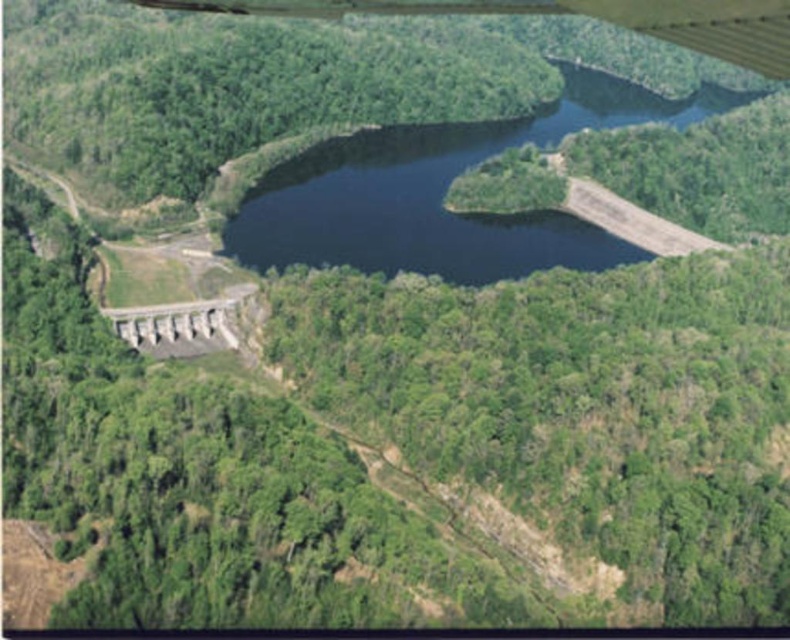
Based on the scene, what does the point at coordinates (442, 193) represent?

The point at coordinates (442, 193) indicates dark blue water at center.

You are a drone operator tasked with capturing aerial footage of the landscape. Your drone is currently at the coordinates provided in the scene description. Where should you direct your drone to capture a clear shot of the dark blue water at center?

The dark blue water at center is located at point (442, 193), so direct the drone to that coordinate to capture the shot.

You are a drone operator who needs to land your drone safely on the dark blue water at center. The drone has a maximum descent speed of 2 meters per second. If the metallic gray wing at upper center is currently directly above your landing spot, how long will it take for the drone to reach the water surface?

The distance between the dark blue water at center and the metallic gray wing at upper center is 246.10 meters. Since the drone descends at 2 meters per second, it will take 246.10 divided by 2, which equals 123.05 seconds, approximately 2 minutes and 3 seconds to reach the water surface.